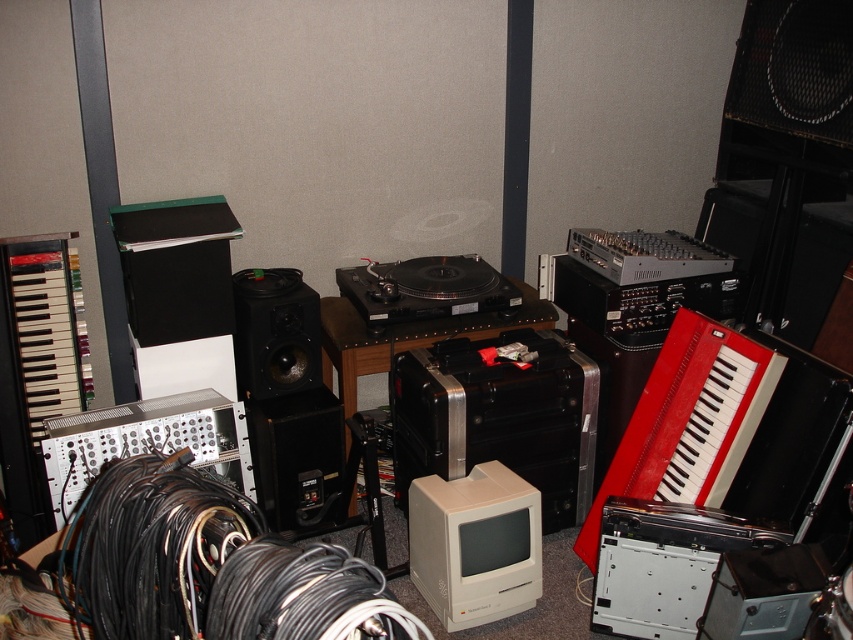
You are standing in the room and want to reach the point marked as point (784, 368). Which direction should you move relative to point (129, 410) to get there?

To reach point (784, 368) from point (129, 410), you should move forward since point (784, 368) is in front of point (129, 410).

In the scene shown: You are standing in the room and want to reach both points. Which point, point [85,536] or point [310,484], will you reach first?

Point [85,536] is closer to the viewer, so you will reach it first.

You are a technician who needs to connect the silver metallic modular synthesizer at lower left to the black matte speaker at center using a 12 inch cable. Is the cable long enough?

The silver metallic modular synthesizer at lower left is 11.51 inches away from the black matte speaker at center. The 12 inch cable is slightly longer than the distance between them, so it should be sufficient for the connection.